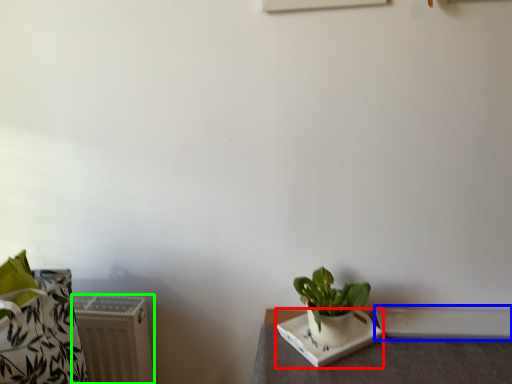
Question: Which object is positioned closest to plate (highlighted by a red box)? Select from window sill (highlighted by a blue box) and radiator (highlighted by a green box).

Choices:
 (A) window sill
 (B) radiator

Answer: (A)